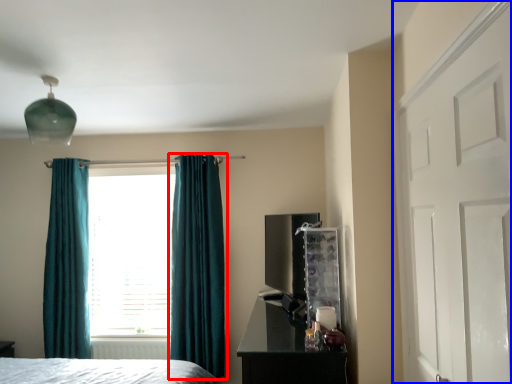
Question: Which of the following is the farthest to the observer, curtain (highlighted by a red box) or door (highlighted by a blue box)?

Choices:
 (A) curtain
 (B) door

Answer: (A)